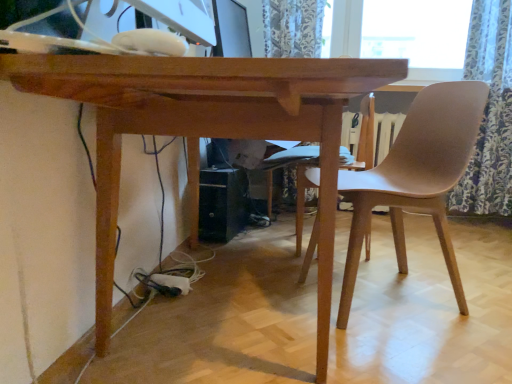
What are the coordinates of `free region under matte brown chair at right (from a real-world perspective)` in the screenshot? It's located at (389, 296).